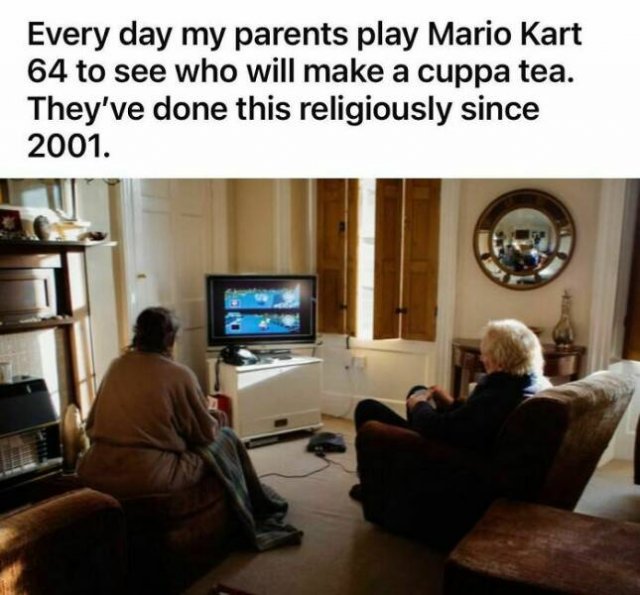
I want to click on brown carpet floor, so click(320, 505).